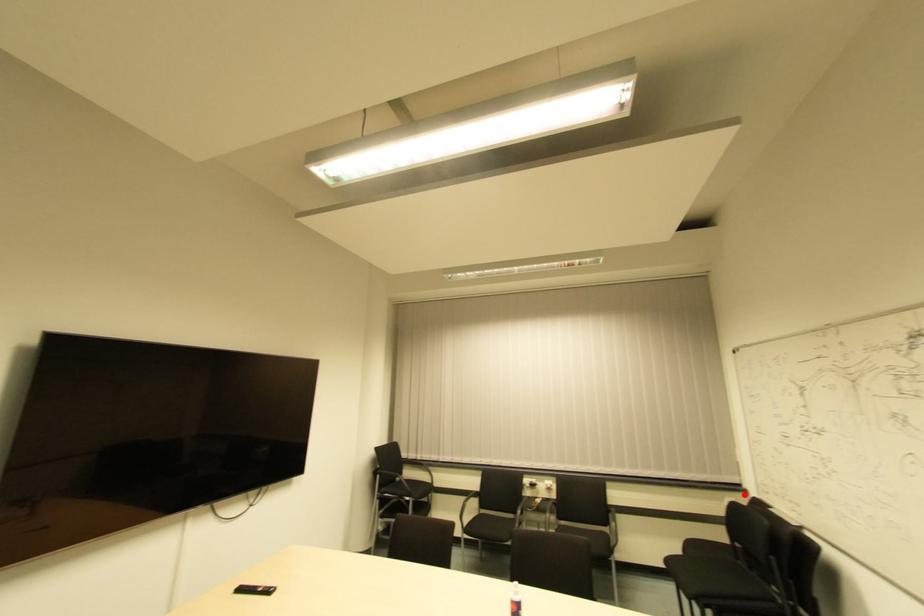
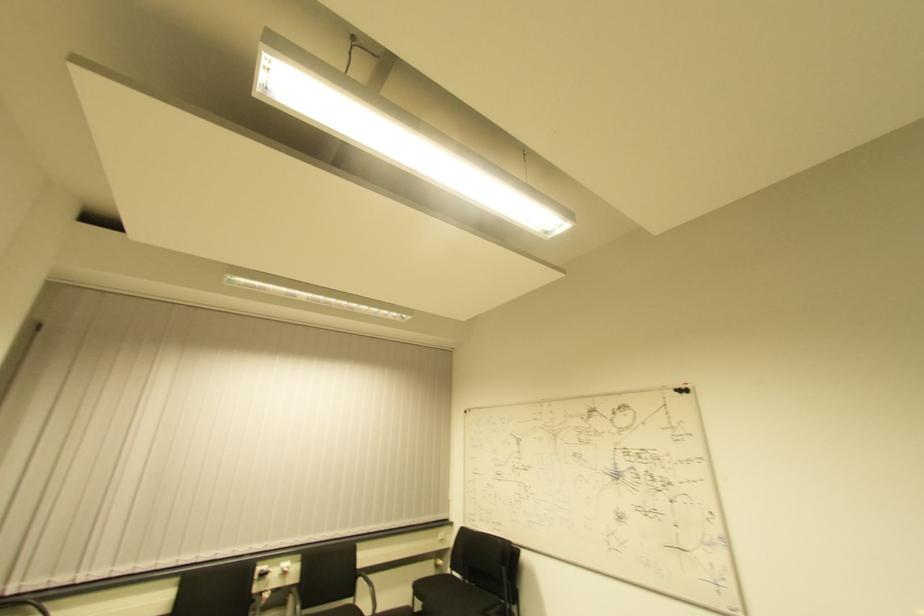
Find the pixel in the second image that matches the highlighted location in the first image.

(450, 527)